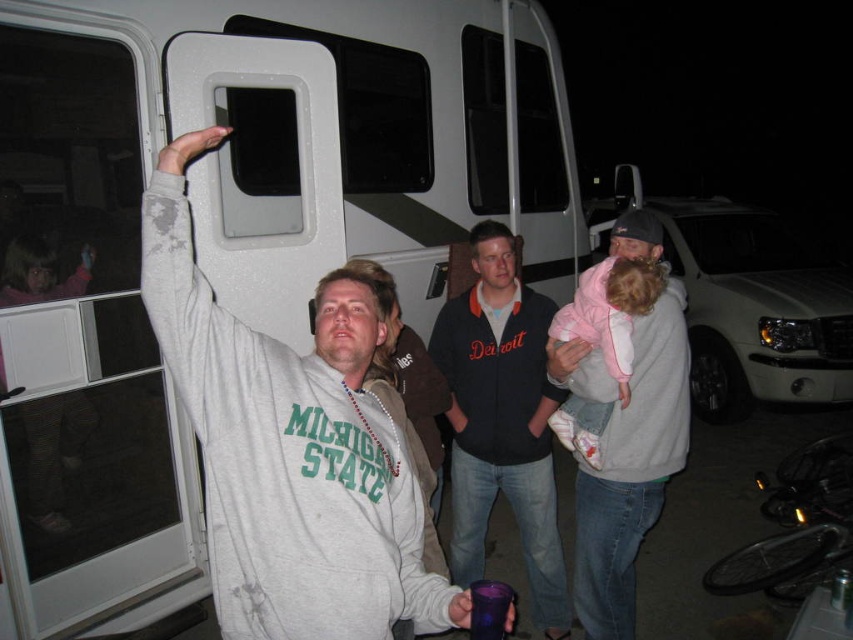
Question: Which of the following is the farthest from the observer?

Choices:
 (A) light pink fleece at upper right
 (B) white plastic recreational vehicle at center
 (C) matte pink hoodie at upper left

Answer: (B)

Question: Which point is closer to the camera taking this photo?

Choices:
 (A) (671, 212)
 (B) (47, 449)
 (C) (579, 410)
 (D) (419, 10)

Answer: (C)

Question: Can you confirm if white matte recreational vehicle at upper center is smaller than white plastic recreational vehicle at center?

Choices:
 (A) yes
 (B) no

Answer: (B)

Question: Does white plastic recreational vehicle at center appear on the right side of matte pink hoodie at upper left?

Choices:
 (A) no
 (B) yes

Answer: (B)

Question: Does dark blue fleece jacket at center lie in front of matte pink hoodie at upper left?

Choices:
 (A) no
 (B) yes

Answer: (B)

Question: Which of the following is the farthest from the observer?

Choices:
 (A) matte pink hoodie at upper left
 (B) white plastic recreational vehicle at center

Answer: (B)